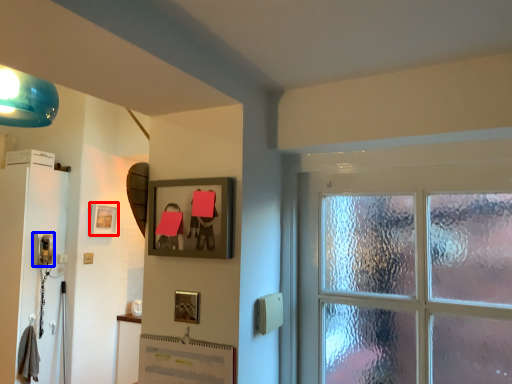
Question: Which object appears closest to the camera in this image, picture frame (highlighted by a red box) or corded phone (highlighted by a blue box)?

Choices:
 (A) picture frame
 (B) corded phone

Answer: (B)